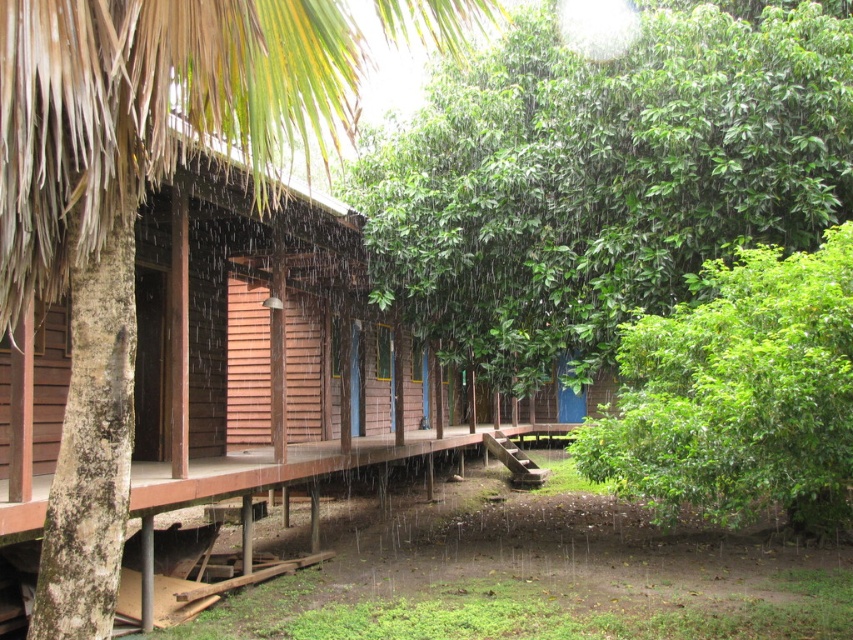
Is the position of green leafy tree at center less distant than that of green leafy bush at right?

No.

Is green leafy tree at center bigger than green leafy bush at right?

Correct, green leafy tree at center is larger in size than green leafy bush at right.

Locate an element on the screen. The height and width of the screenshot is (640, 853). green leafy tree at center is located at coordinates (605, 177).

Between green leafy tree at center and brown textured palm leaf at upper left, which one has more height?

Standing taller between the two is green leafy tree at center.

From the picture: Which of these two, green leafy tree at center or brown textured palm leaf at upper left, stands shorter?

brown textured palm leaf at upper left

Is point (786, 138) less distant than point (225, 51)?

No, it is not.

You are a GUI agent. You are given a task and a screenshot of the screen. Output one action in this format:
    pyautogui.click(x=<x>, y=<y>)
    Task: Click on the green leafy tree at center
    The image size is (853, 640).
    Given the screenshot: What is the action you would take?
    [605, 177]

Does brown textured palm leaf at upper left have a lesser height compared to green leafy bush at right?

In fact, brown textured palm leaf at upper left may be taller than green leafy bush at right.

Is brown textured palm leaf at upper left to the right of green leafy bush at right from the viewer's perspective?

No, brown textured palm leaf at upper left is not to the right of green leafy bush at right.

Is point (102, 102) positioned in front of point (752, 326)?

Yes.

You are a GUI agent. You are given a task and a screenshot of the screen. Output one action in this format:
    pyautogui.click(x=<x>, y=<y>)
    Task: Click on the brown textured palm leaf at upper left
    The width and height of the screenshot is (853, 640).
    Given the screenshot: What is the action you would take?
    click(x=132, y=205)